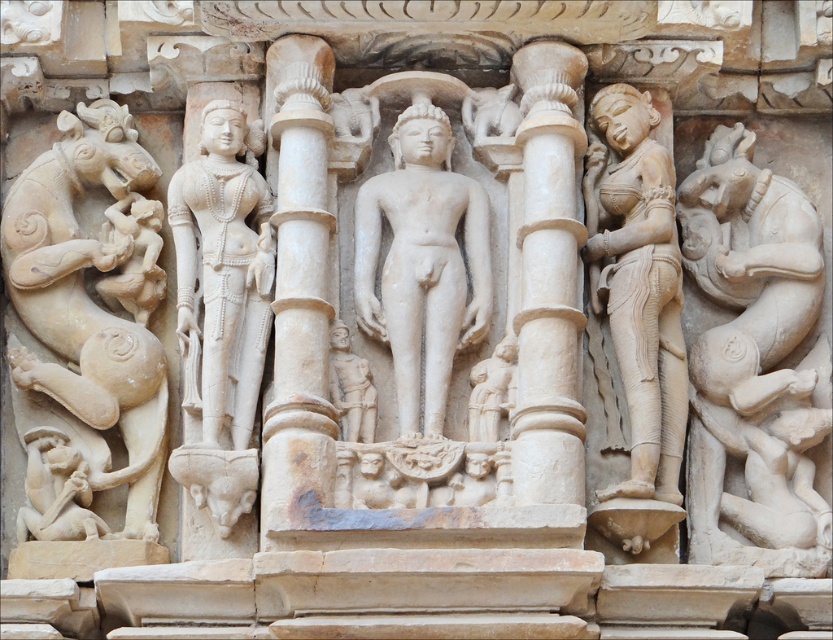
Based on the scene description, can you determine if the white marble statue at center is placed on top of the white marble column at center?

The white marble statue at center is positioned over the white marble column at center, so yes, the statue is placed on top of the column.

You are an art historian examining the stone carving. You notice the white stone elephant at right and the beige stone sculpture at left. Which of these two objects is positioned closer to you?

The white stone elephant at right is closer to the viewer than the beige stone sculpture at left.

Based on the scene description, can you determine the spatial relationship between the white marble statue at left and the white marble column at center? Is the statue positioned above or below the column?

The white marble statue at left is located above the white marble column at center.